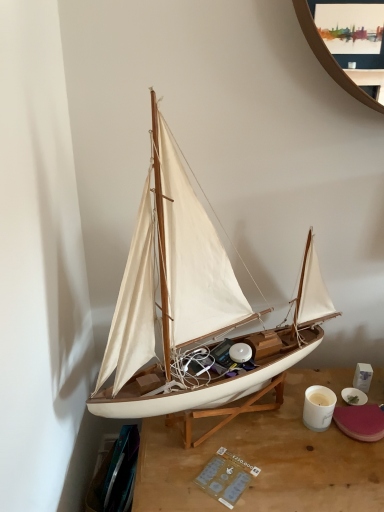
At what (x,y) coordinates should I click in order to perform the action: click on vacant space behind white glossy coffee cup at lower right. Please return your answer as a coordinate pair (x, y). This screenshot has height=512, width=384. Looking at the image, I should click on (308, 384).